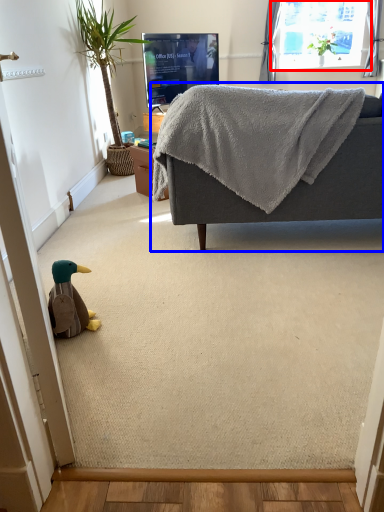
Question: Among these objects, which one is farthest to the camera, window (highlighted by a red box) or studio couch (highlighted by a blue box)?

Choices:
 (A) window
 (B) studio couch

Answer: (A)